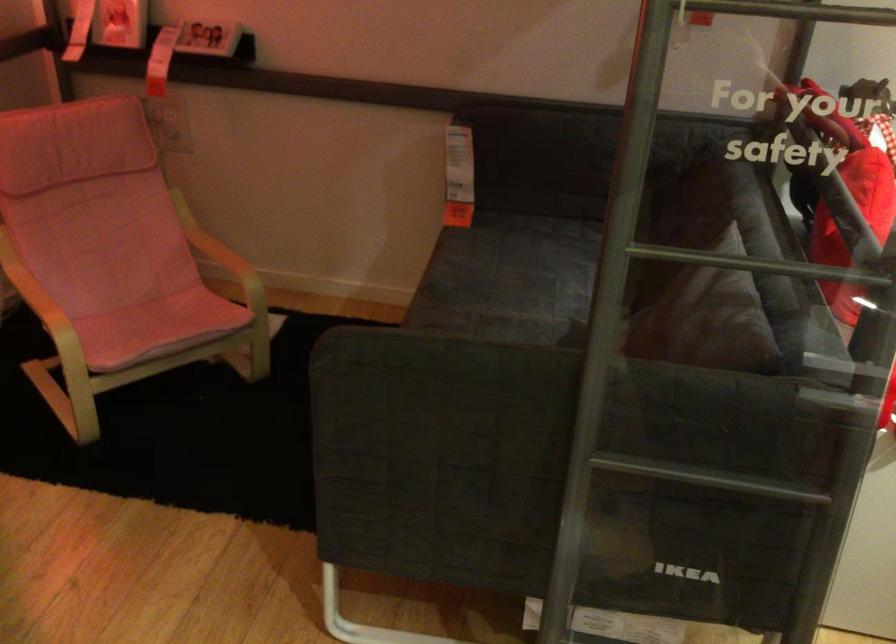
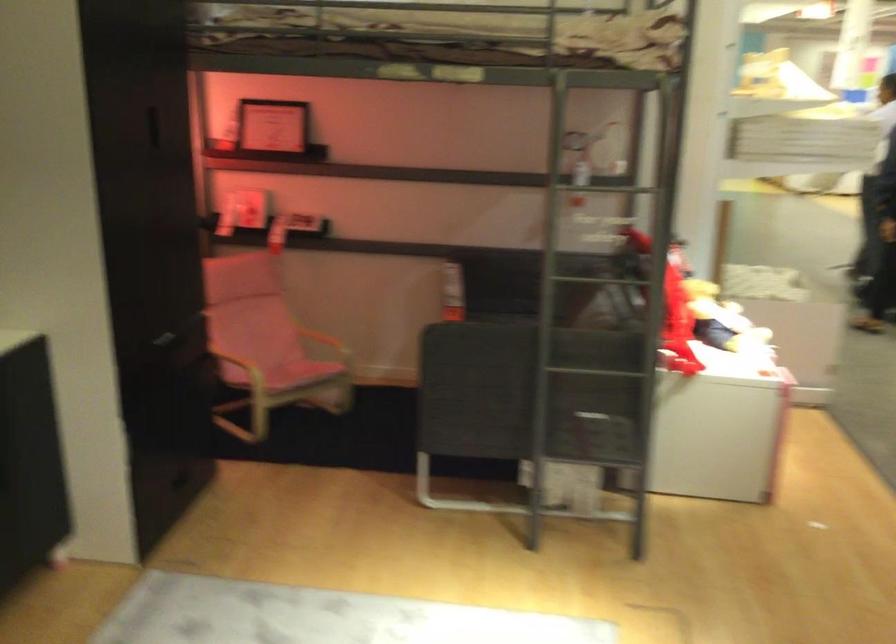
Where in the second image is the point corresponding to the point at 687,250 from the first image?

(591, 278)